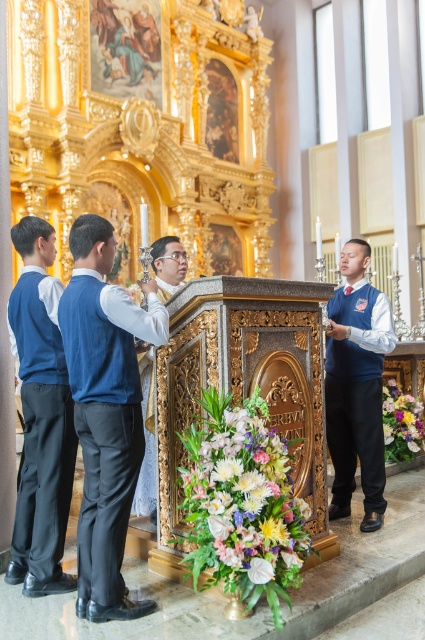
Question: Can you confirm if blue fabric vest at center is positioned to the left of vibrant floral bouquet at lower right?

Choices:
 (A) yes
 (B) no

Answer: (A)

Question: Does floral bouquet at lower center have a lesser width compared to blue velvet vest at right?

Choices:
 (A) no
 (B) yes

Answer: (A)

Question: Among these points, which one is nearest to the camera?

Choices:
 (A) (155, 248)
 (B) (410, 406)
 (C) (57, 582)

Answer: (C)

Question: Is blue velvet vest at right closer to the viewer compared to vibrant floral bouquet at lower right?

Choices:
 (A) yes
 (B) no

Answer: (A)

Question: Which of these objects is positioned closest to the floral bouquet at lower center?

Choices:
 (A) blue velvet vest at right
 (B) matte gold vest at center

Answer: (B)

Question: Which of the following is the farthest from the observer?

Choices:
 (A) blue velvet vest at right
 (B) blue fabric vest at center

Answer: (A)